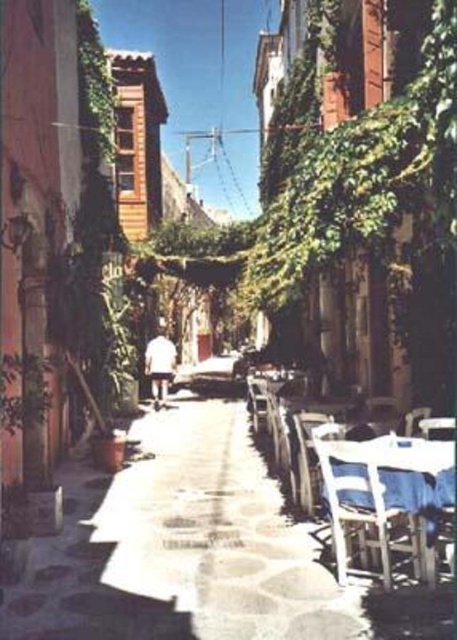
Can you confirm if wooden table at lower right is taller than white plastic chair at center?

Indeed, wooden table at lower right has a greater height compared to white plastic chair at center.

Who is positioned more to the left, wooden table at lower right or white plastic chair at center?

From the viewer's perspective, white plastic chair at center appears more on the left side.

I want to click on wooden table at lower right, so click(x=384, y=493).

Who is lower down, white plastic chair at center or white plastic chair at lower right?

white plastic chair at center is lower down.

Can you confirm if white plastic chair at center is smaller than white plastic chair at lower right?

Incorrect, white plastic chair at center is not smaller in size than white plastic chair at lower right.

Locate an element on the screen. This screenshot has height=640, width=457. white plastic chair at center is located at coordinates (307, 458).

Is point (324, 470) in front of point (171, 364)?

Yes, it is in front of point (171, 364).

Based on the photo, between wooden table at lower right and white matte shirt at center, which one has more height?

With more height is white matte shirt at center.

Where is `wooden table at lower right`? wooden table at lower right is located at coordinates (384, 493).